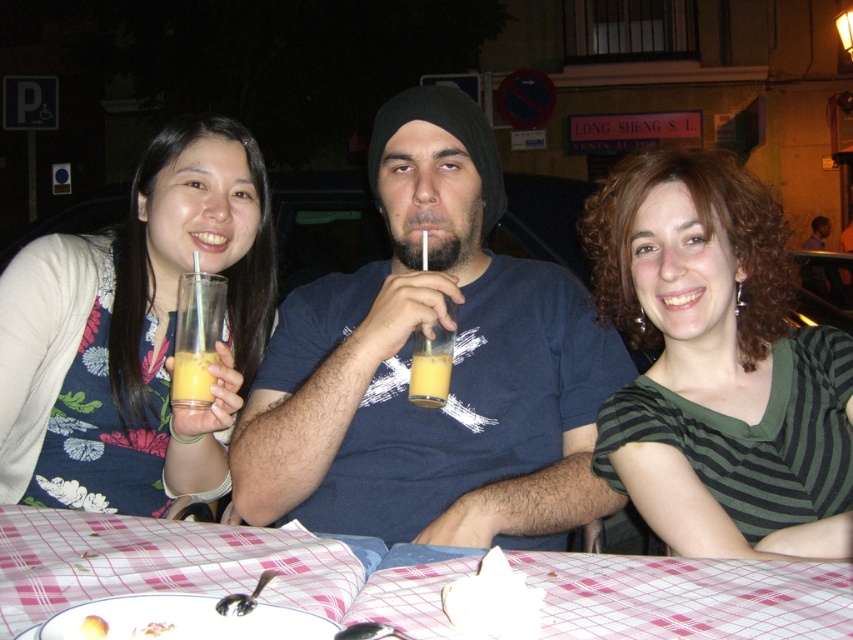
You are a waiter at a cafe and need to place a dessert plate on the table. The table has a pink checkered tablecloth at lower center and a yellow matte juice glass at center. Where should you place the dessert plate so it doesn not obstruct the juice glass?

Place the dessert plate to the right of the yellow matte juice glass at center, since the pink checkered tablecloth at lower center is already to the right of the juice glass, leaving space there for the plate without blocking it.